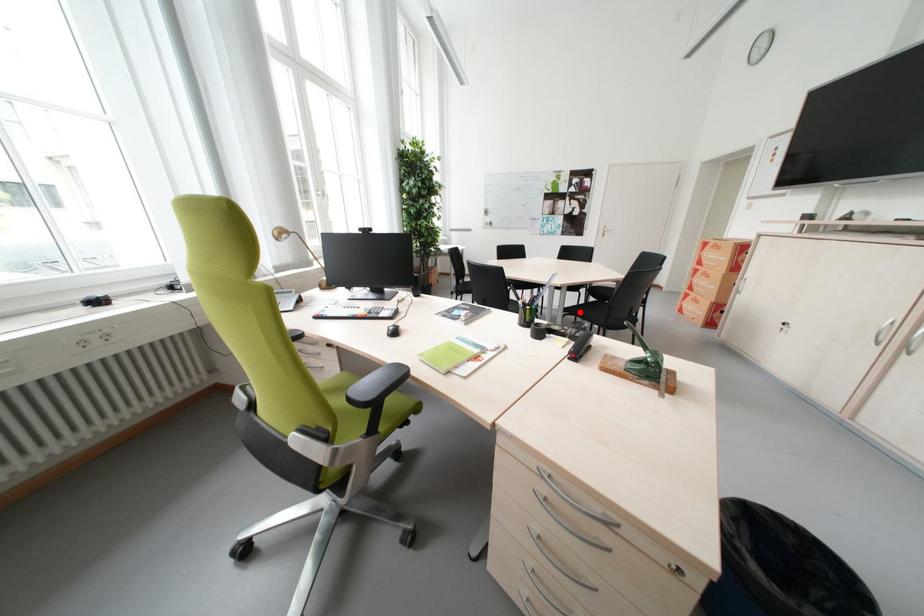
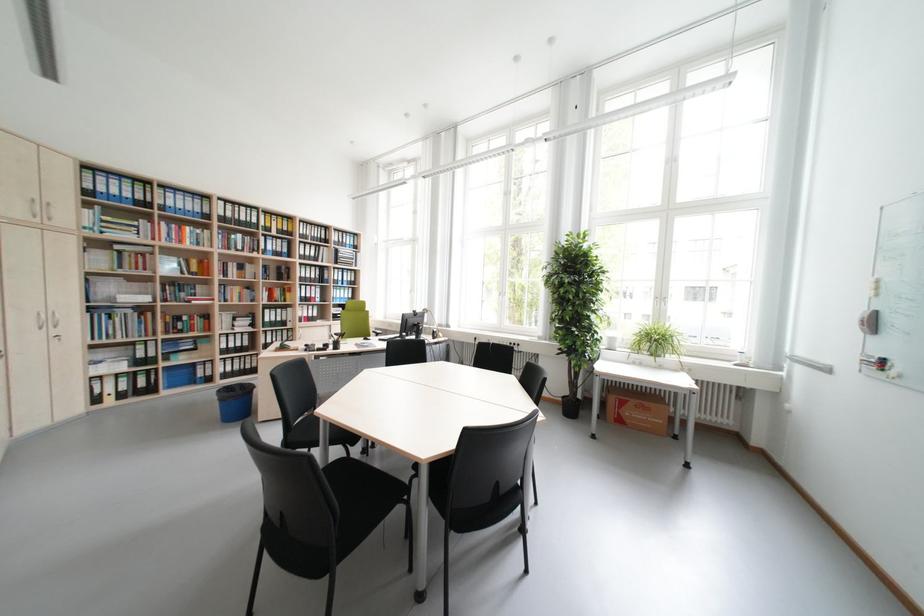
Question: I am providing you with two images of the same scene from different viewpoints. A red point is marked on the first image. Can you still see the location of the red point in image 2?

Choices:
 (A) Yes
 (B) No

Answer: (B)